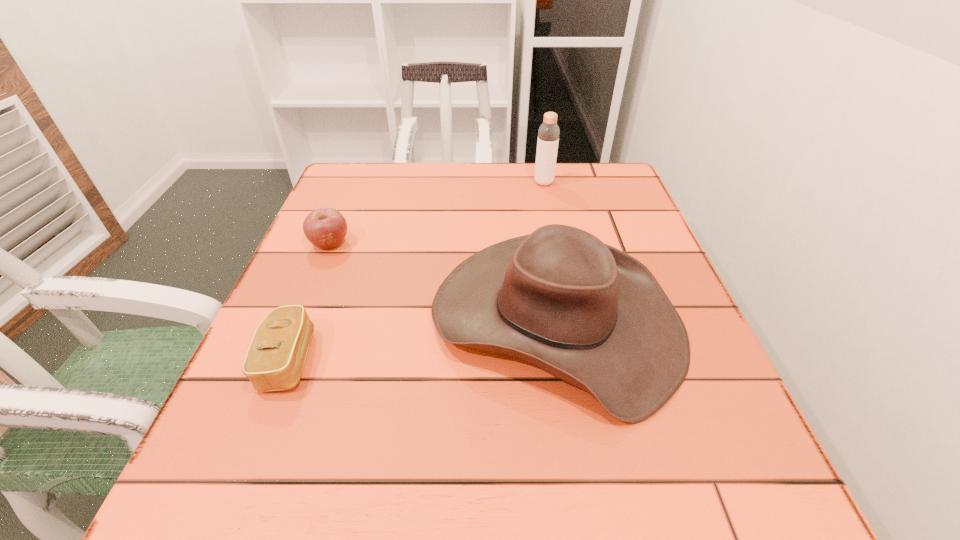
Where is `free spot that satisfies the following two spatial constraints: 1. on the side of the apple with the unique marking; 2. on the left side of the second tallest object`? This screenshot has height=540, width=960. free spot that satisfies the following two spatial constraints: 1. on the side of the apple with the unique marking; 2. on the left side of the second tallest object is located at coordinates (300, 319).

Identify the location of free spot that satisfies the following two spatial constraints: 1. on the back side of the tallest object; 2. on the right side of the third shortest object. (532, 183).